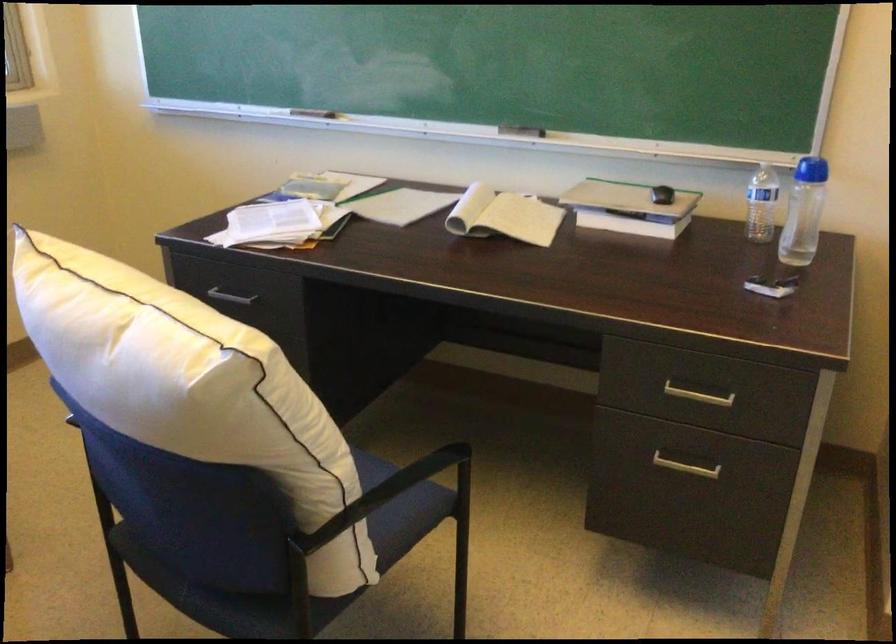
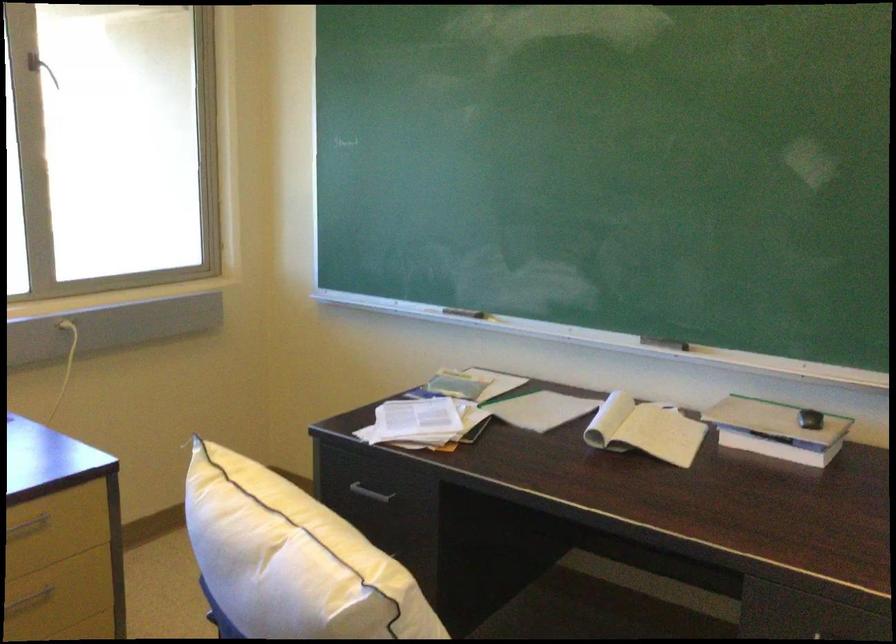
In the second image, find the point that corresponds to (138,337) in the first image.

(291, 559)